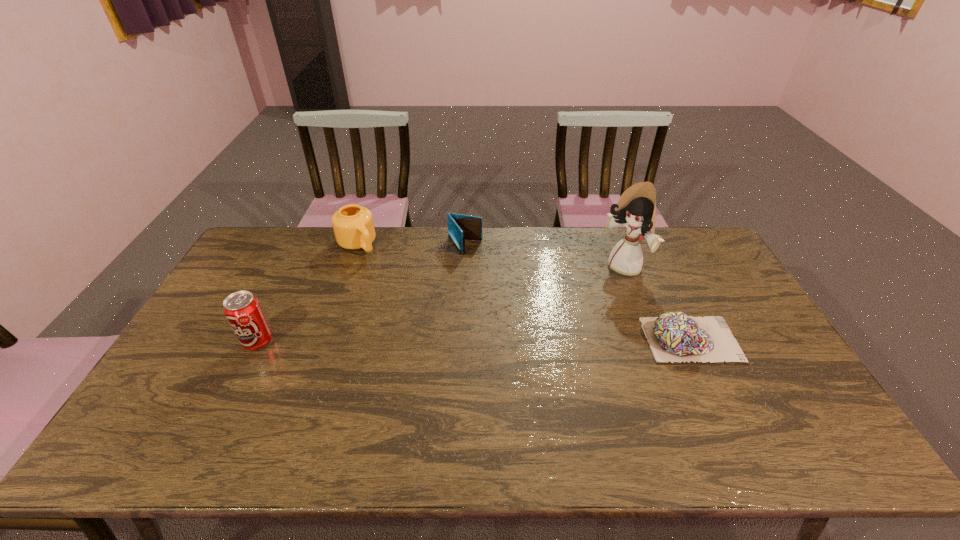
The image size is (960, 540). In order to click on vacant space located on the exterior surface of the second shortest object in this screenshot , I will do `click(503, 294)`.

Locate an element on the screen. This screenshot has height=540, width=960. free spot located on the exterior surface of the second shortest object is located at coordinates (483, 268).

Locate an element on the screen. vacant area situated on the exterior surface of the second shortest object is located at coordinates (493, 281).

This screenshot has height=540, width=960. What are the coordinates of `vacant area situated at the front face of the tallest object` in the screenshot? It's located at (588, 295).

Find the location of `vacant space positioned 0.380m at the front face of the tallest object`. vacant space positioned 0.380m at the front face of the tallest object is located at coordinates (532, 336).

Where is `free space located 0.310m at the front face of the tallest object`? free space located 0.310m at the front face of the tallest object is located at coordinates (547, 324).

Where is `free region located on the handle side of the second object from left to right`? The height and width of the screenshot is (540, 960). free region located on the handle side of the second object from left to right is located at coordinates (388, 280).

The height and width of the screenshot is (540, 960). I want to click on vacant area located on the handle side of the second object from left to right, so click(412, 308).

Image resolution: width=960 pixels, height=540 pixels. I want to click on free space located 0.180m on the handle side of the second object from left to right, so click(x=391, y=284).

This screenshot has width=960, height=540. In order to click on wallet located in the far edge section of the desktop in this screenshot , I will do `click(461, 227)`.